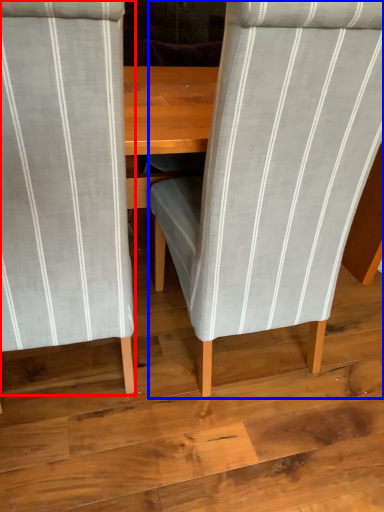
Question: Which point is further to the camera, chair (highlighted by a red box) or chair (highlighted by a blue box)?

Choices:
 (A) chair
 (B) chair

Answer: (B)